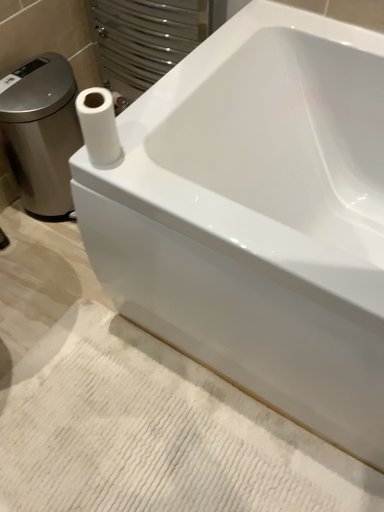
Image resolution: width=384 pixels, height=512 pixels. What are the coordinates of `free space above white glossy porcelain at left (from a real-world perspective)` in the screenshot? It's located at [33, 76].